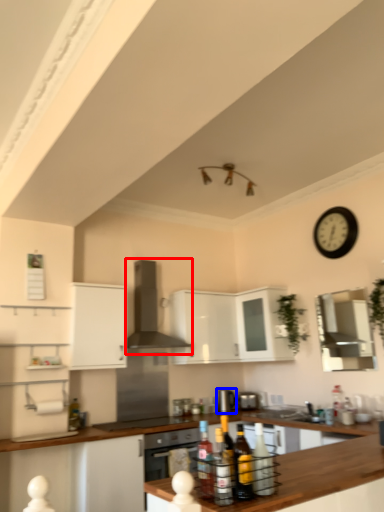
Question: Which point is closer to the camera, exhaust hood (highlighted by a red box) or appliance (highlighted by a blue box)?

Choices:
 (A) exhaust hood
 (B) appliance

Answer: (A)